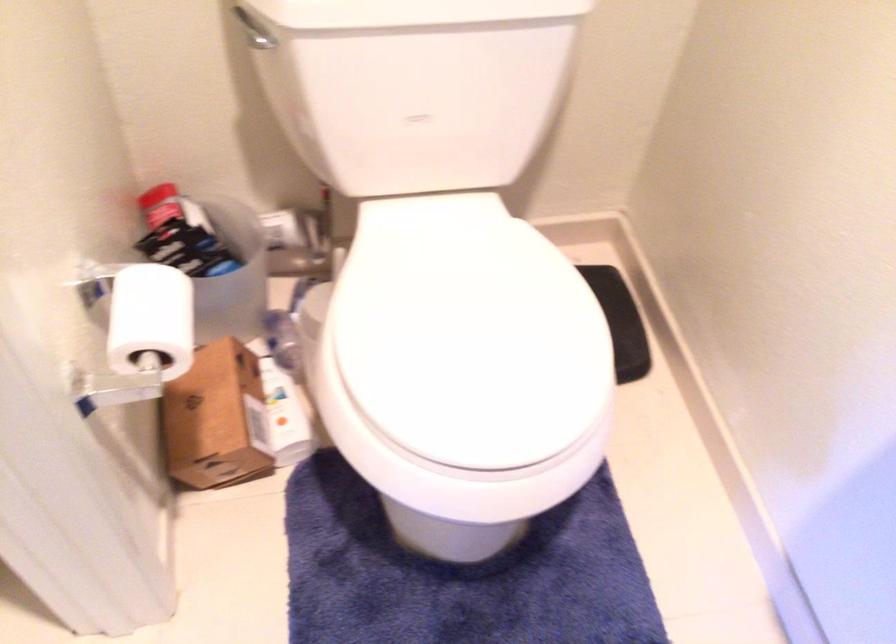
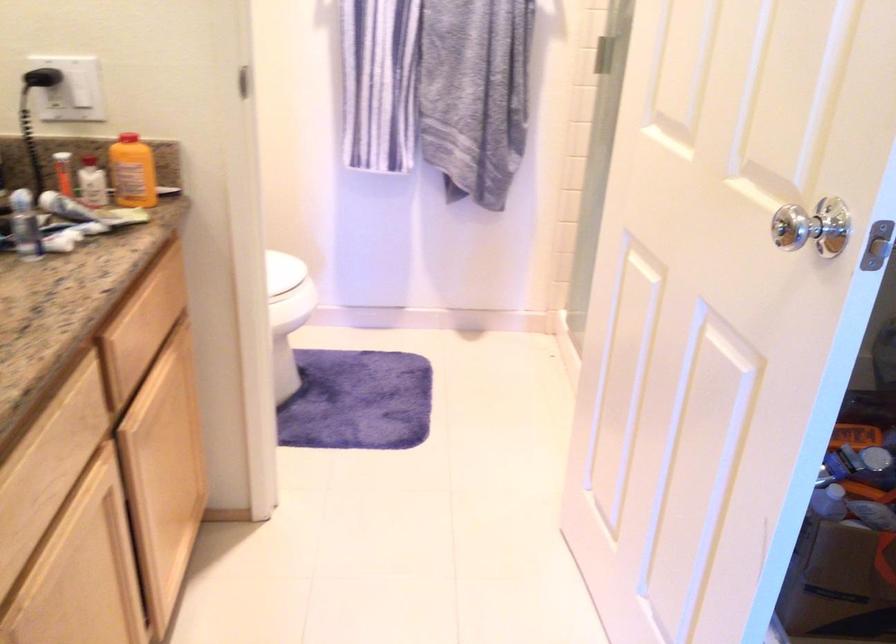
Question: I am providing you with two images of the same scene from different viewpoints. Which of the following objects are not visible in image2?

Choices:
 (A) black electrical plug
 (B) red door curtain
 (C) white light switch
 (D) small cardboard box

Answer: (D)